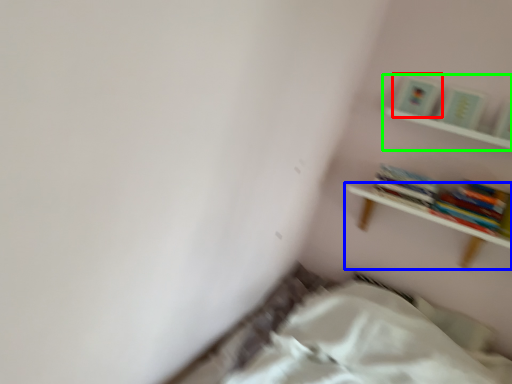
Question: Which object is positioned farthest from paperback book (highlighted by a red box)? Select from shelf (highlighted by a blue box) and shelf (highlighted by a green box).

Choices:
 (A) shelf
 (B) shelf

Answer: (A)